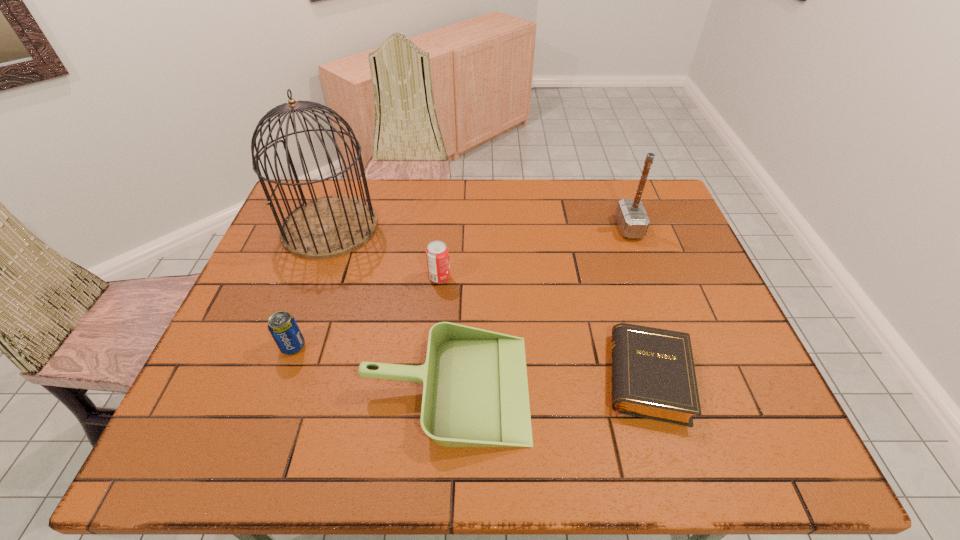
The height and width of the screenshot is (540, 960). In the image, there is a desktop. In order to click on vacant space at the near left corner in this screenshot , I will do `click(228, 440)`.

Image resolution: width=960 pixels, height=540 pixels. I want to click on vacant space at the far right corner of the desktop, so click(x=634, y=198).

Image resolution: width=960 pixels, height=540 pixels. I want to click on vacant space at the near right corner of the desktop, so click(x=756, y=457).

The width and height of the screenshot is (960, 540). What are the coordinates of `free space between the hammer and the left soda` in the screenshot? It's located at (x=461, y=287).

Locate an element on the screen. This screenshot has height=540, width=960. vacant point located between the right soda and the shortest object is located at coordinates (543, 327).

Image resolution: width=960 pixels, height=540 pixels. In order to click on free spot between the farther soda and the shortest object in this screenshot , I will do `click(543, 327)`.

Locate an element on the screen. This screenshot has height=540, width=960. vacant point located between the tallest object and the farther soda is located at coordinates (385, 252).

You are a GUI agent. You are given a task and a screenshot of the screen. Output one action in this format:
    pyautogui.click(x=<x>, y=<y>)
    Task: Click on the vacant area that lies between the nearer soda and the birdcage
    The image size is (960, 540).
    Given the screenshot: What is the action you would take?
    pyautogui.click(x=311, y=286)

The width and height of the screenshot is (960, 540). Identify the location of vacant space that is in between the tallest object and the farther soda. (385, 252).

You are a GUI agent. You are given a task and a screenshot of the screen. Output one action in this format:
    pyautogui.click(x=<x>, y=<y>)
    Task: Click on the vacant area that lies between the shortest object and the birdcage
    This screenshot has height=540, width=960.
    Given the screenshot: What is the action you would take?
    click(x=489, y=302)